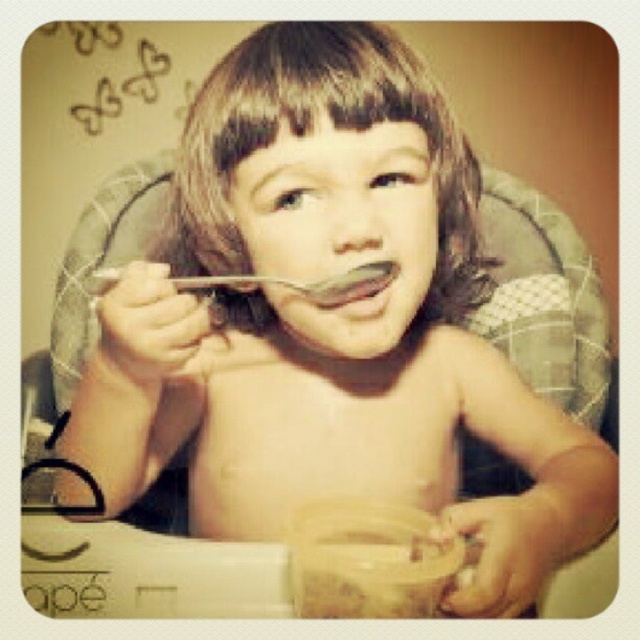
You are a parent trying to give your child a spoon. You see two spoons at the child mouth, a metallic silver spoon at mouth and a matte silver spoon at mouth. Which spoon is closer to the child mouth?

Both the metallic silver spoon at mouth and matte silver spoon at mouth are at the mouth, so they are equally close to the child mouth.

You are a parent trying to give your child a snack. You see the translucent plastic jar at lower center and the metallic silver spoon at mouth. Which object is closer to the child?

The translucent plastic jar at lower center is closer to the child because it is in front of the metallic silver spoon at mouth.